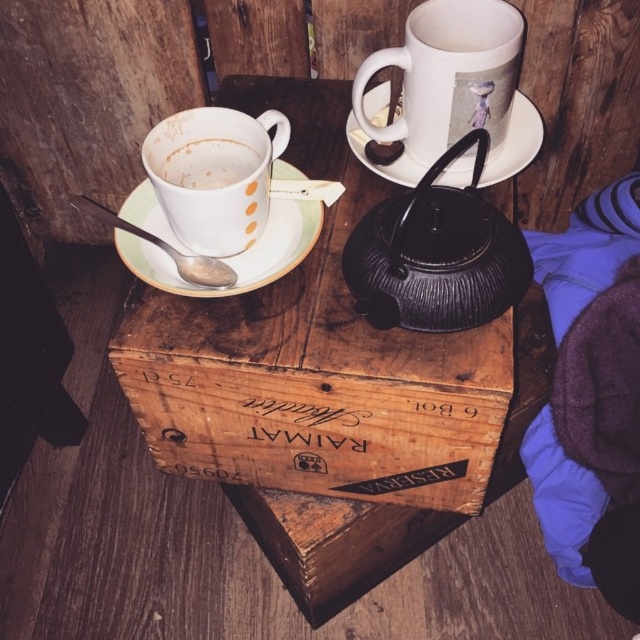
You are setting up a tea service on the wooden crate table. You have a white ceramic saucer at upper center and a white matte cup at upper left. Which item has a greater width?

The white ceramic saucer at upper center has a greater width than the white matte cup at upper left.

You are a photographer taking a closeup shot of the wooden crate. You notice two points marked in the scene at coordinates point (168, 371) and point (426, 266). Which point is closer to your camera lens?

Point (168, 371) is further to the camera than point (426, 266), so the point closer to the camera lens is point (168, 371).